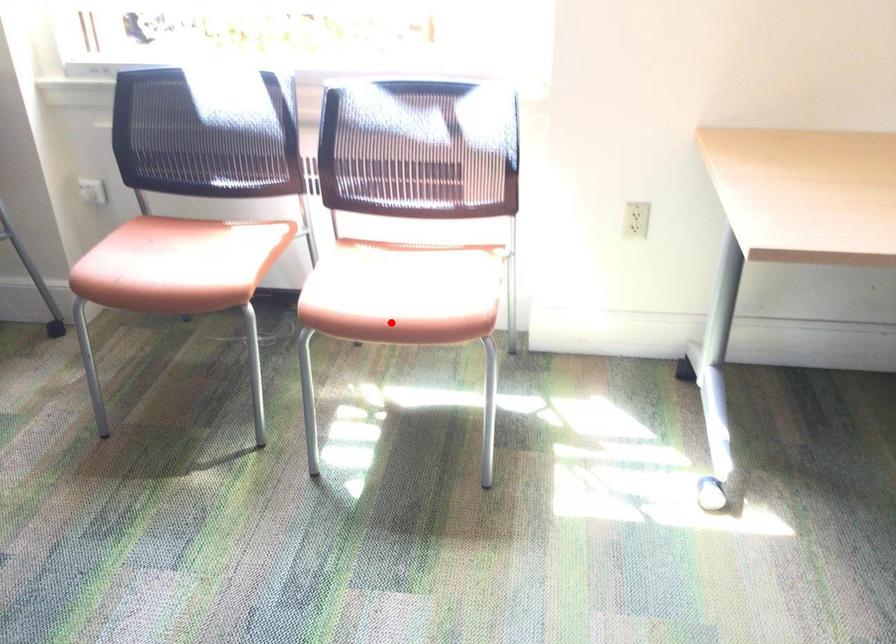
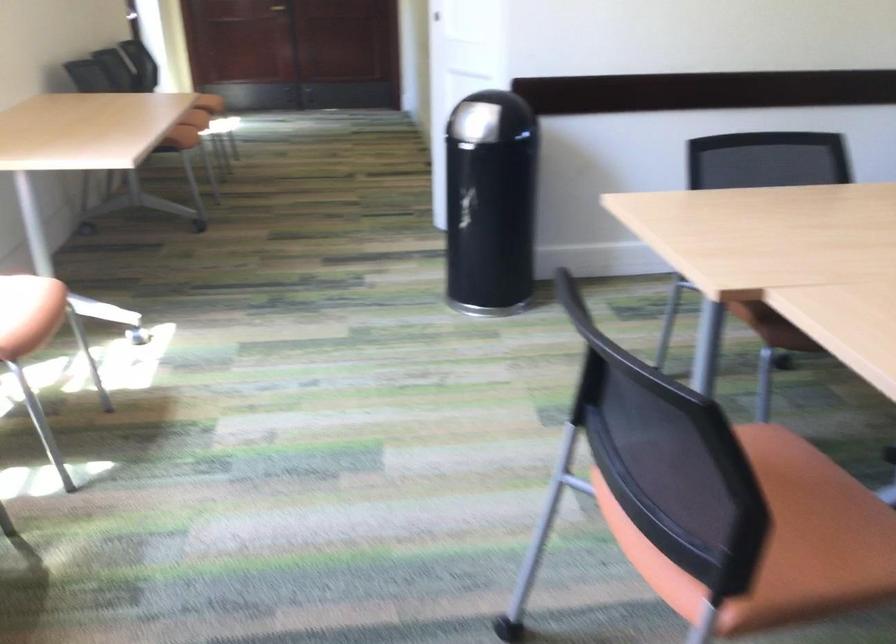
The point at the highlighted location is marked in the first image. Where is the corresponding point in the second image?

(40, 313)